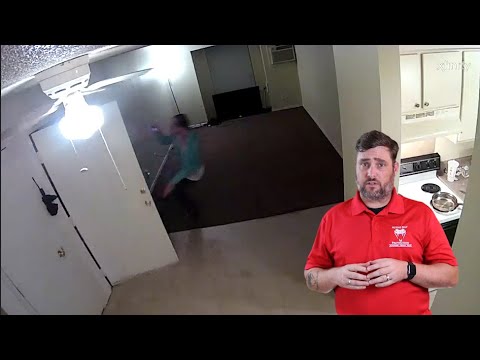
Locate an element on the screen. This screenshot has height=360, width=480. light on lamp is located at coordinates (84, 128).